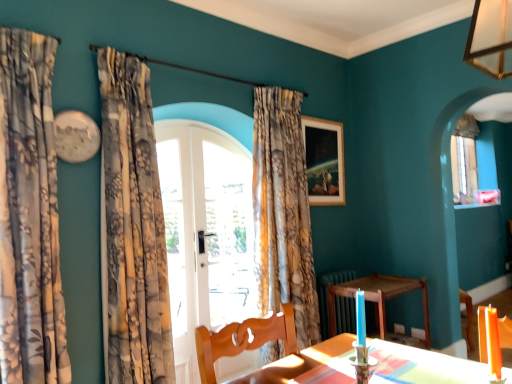
The height and width of the screenshot is (384, 512). What are the coordinates of `free space above wooden picture frame at upper center (from a real-world perspective)` in the screenshot? It's located at (320, 117).